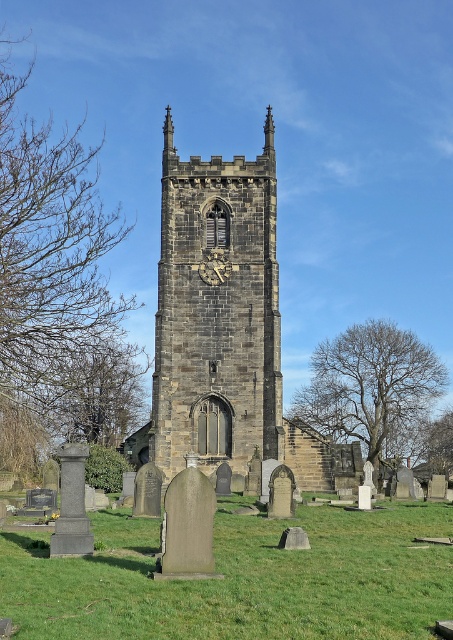
Who is lower down, green grass at lower center or dark gray stone clock at center?

green grass at lower center

Does green grass at lower center have a smaller size compared to dark gray stone clock at center?

No.

Where is `green grass at lower center`? The image size is (453, 640). green grass at lower center is located at coordinates (240, 579).

Between green grass at lower center and dark gray stone church tower at center, which one has more height?

dark gray stone church tower at center is taller.

Does point (29, 534) come farther from viewer compared to point (196, 380)?

No, it is not.

Is point (133, 545) positioned before point (215, 212)?

Yes, it is in front of point (215, 212).

Identify the location of green grass at lower center. (240, 579).

Is point (163, 252) more distant than point (201, 276)?

Yes.

In the scene shown: Which is more to the left, dark gray stone church tower at center or dark gray stone clock at center?

From the viewer's perspective, dark gray stone clock at center appears more on the left side.

Locate an element on the screen. dark gray stone church tower at center is located at coordinates (221, 326).